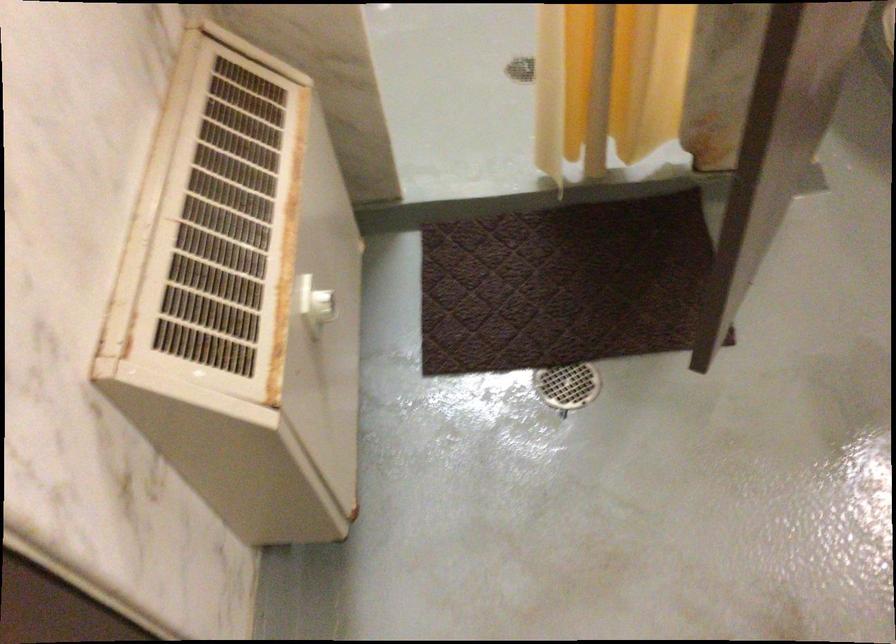
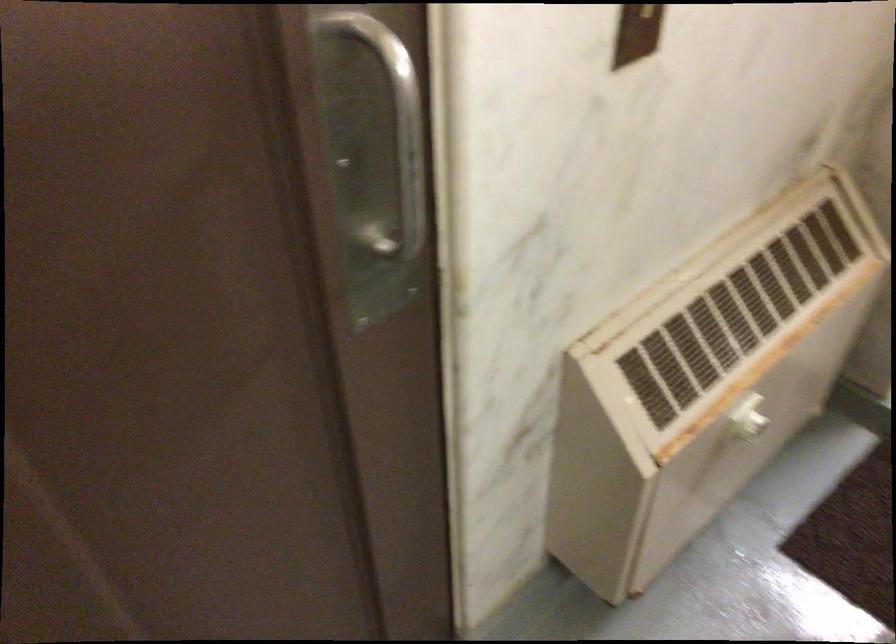
Question: The camera is either moving clockwise (left) or counter-clockwise (right) around the object. The first image is from the beginning of the video and the second image is from the end. Is the camera moving left or right when shooting the video?

Choices:
 (A) Left
 (B) Right

Answer: (B)